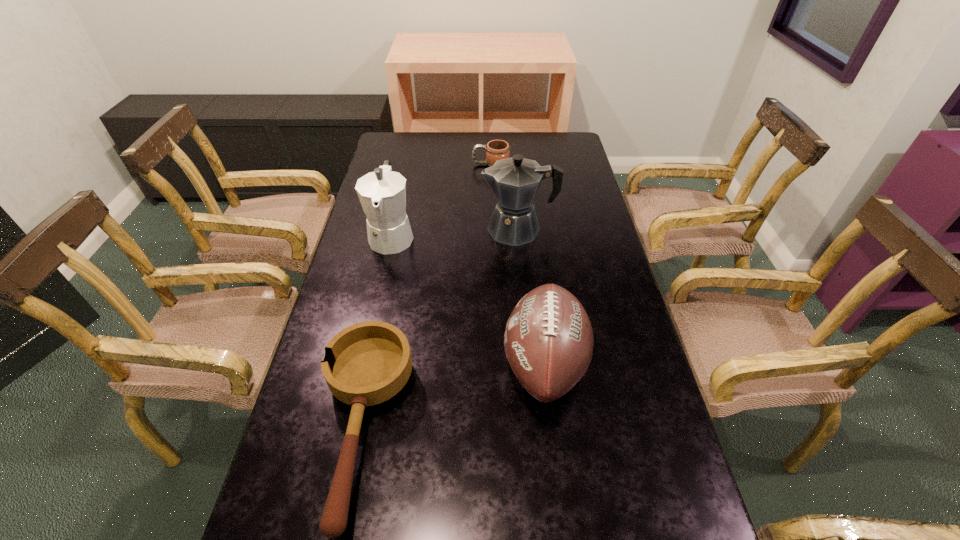
The image size is (960, 540). Identify the location of vacant space positioned 0.080m on the side of the farthest object with the handle. (452, 165).

This screenshot has height=540, width=960. In order to click on vacant space situated 0.150m on the side of the farthest object with the handle in this screenshot , I will do coord(434,165).

You are a GUI agent. You are given a task and a screenshot of the screen. Output one action in this format:
    pyautogui.click(x=<x>, y=<y>)
    Task: Click on the object that is at the far edge
    The width and height of the screenshot is (960, 540).
    Given the screenshot: What is the action you would take?
    pyautogui.click(x=496, y=150)

Locate an element on the screen. The height and width of the screenshot is (540, 960). object present at the left edge is located at coordinates (382, 193).

Where is `coffeepot that is at the right edge`? The height and width of the screenshot is (540, 960). coffeepot that is at the right edge is located at coordinates (515, 181).

Where is `football (American) located at the right edge`? The image size is (960, 540). football (American) located at the right edge is located at coordinates (548, 340).

In the image, there is a desktop. At what (x,y) coordinates should I click in order to perform the action: click on free space at the far edge. Please return your answer as a coordinate pair (x, y). Image resolution: width=960 pixels, height=540 pixels. Looking at the image, I should click on (488, 135).

Find the location of a particular element. Image resolution: width=960 pixels, height=540 pixels. free space at the left edge is located at coordinates (366, 244).

Where is `vacant area at the right edge`? The width and height of the screenshot is (960, 540). vacant area at the right edge is located at coordinates (595, 248).

In the image, there is a desktop. At what (x,y) coordinates should I click in order to perform the action: click on vacant region at the far left corner. Please return your answer as a coordinate pair (x, y). This screenshot has height=540, width=960. Looking at the image, I should click on (388, 134).